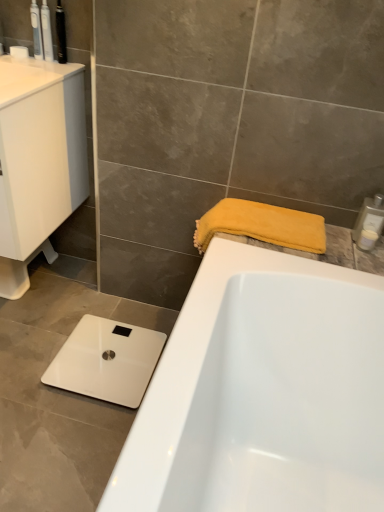
The height and width of the screenshot is (512, 384). In order to click on free space to the left of white plastic soap dispenser at upper right, the 4th toiletry from the top in this screenshot , I will do `click(331, 241)`.